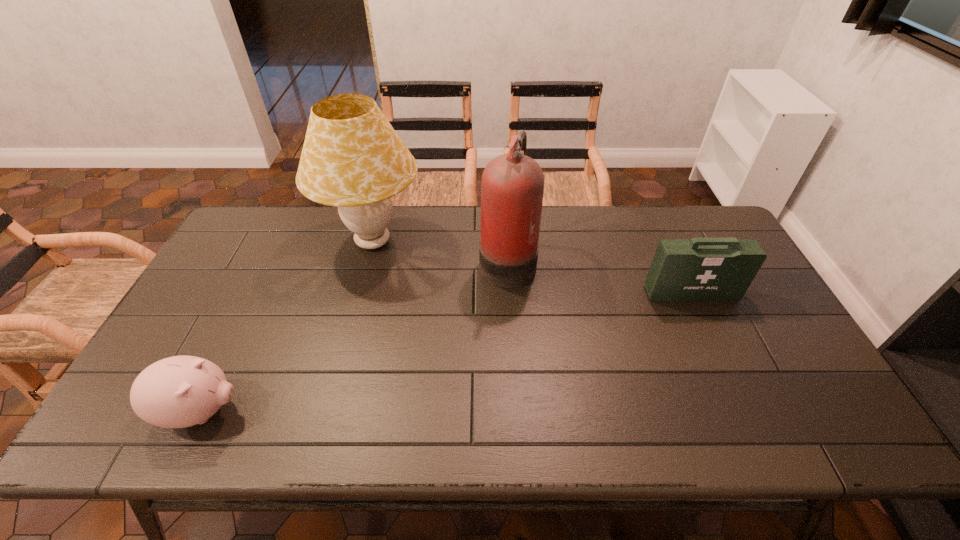
Find the location of `free space located on the front-facing side of the second shortest object`. free space located on the front-facing side of the second shortest object is located at coordinates (755, 430).

The image size is (960, 540). I want to click on vacant point located at the snout of the shortest object, so click(x=399, y=411).

Identify the location of lampshade that is at the far edge. Image resolution: width=960 pixels, height=540 pixels. (352, 158).

I want to click on fire extinguisher that is at the far edge, so click(512, 187).

Image resolution: width=960 pixels, height=540 pixels. In order to click on object located in the near edge section of the desktop in this screenshot , I will do `click(181, 391)`.

Image resolution: width=960 pixels, height=540 pixels. I want to click on object that is at the left edge, so (181, 391).

At what (x,y) coordinates should I click in order to perform the action: click on object at the right edge. Please return your answer as a coordinate pair (x, y). The width and height of the screenshot is (960, 540). Looking at the image, I should click on (704, 269).

You are a GUI agent. You are given a task and a screenshot of the screen. Output one action in this format:
    pyautogui.click(x=<x>, y=<y>)
    Task: Click on the object that is at the near left corner
    The height and width of the screenshot is (540, 960).
    Given the screenshot: What is the action you would take?
    pyautogui.click(x=181, y=391)

At what (x,y) coordinates should I click in order to perform the action: click on free space at the far edge. Please return your answer as a coordinate pair (x, y). This screenshot has height=540, width=960. Looking at the image, I should click on (659, 216).

Locate an element on the screen. This screenshot has height=540, width=960. vacant space at the near edge is located at coordinates (541, 428).